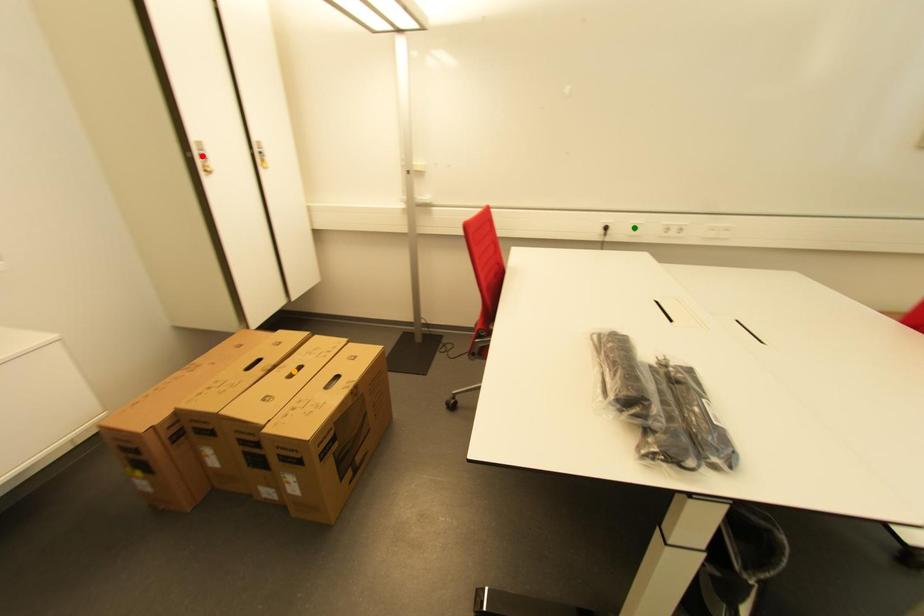
Order these from nearest to farthest:
A) orange point
B) red point
C) green point

green point → red point → orange point